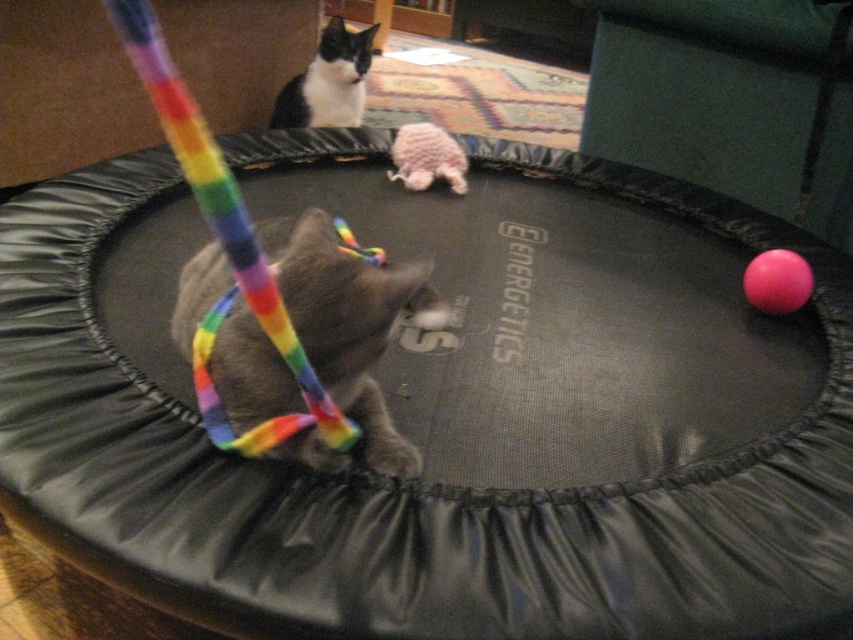
Does matte green cushion at upper right appear on the left side of fuzzy pink toy at center?

No, matte green cushion at upper right is not to the left of fuzzy pink toy at center.

The image size is (853, 640). Find the location of `matte green cushion at upper right`. matte green cushion at upper right is located at coordinates (730, 100).

The width and height of the screenshot is (853, 640). I want to click on matte green cushion at upper right, so click(730, 100).

Does brown fur cat at center lie behind fuzzy pink toy at center?

That is False.

Describe the element at coordinates (350, 324) in the screenshot. I see `brown fur cat at center` at that location.

What do you see at coordinates (350, 324) in the screenshot?
I see `brown fur cat at center` at bounding box center [350, 324].

This screenshot has width=853, height=640. Find the location of `brown fur cat at center`. brown fur cat at center is located at coordinates (350, 324).

From the picture: Which of these two, rainbow fabric toy at center or brown fur cat at center, stands shorter?

With less height is brown fur cat at center.

Does rainbow fabric toy at center lie behind brown fur cat at center?

No, it is in front of brown fur cat at center.

The height and width of the screenshot is (640, 853). I want to click on rainbow fabric toy at center, so click(x=277, y=301).